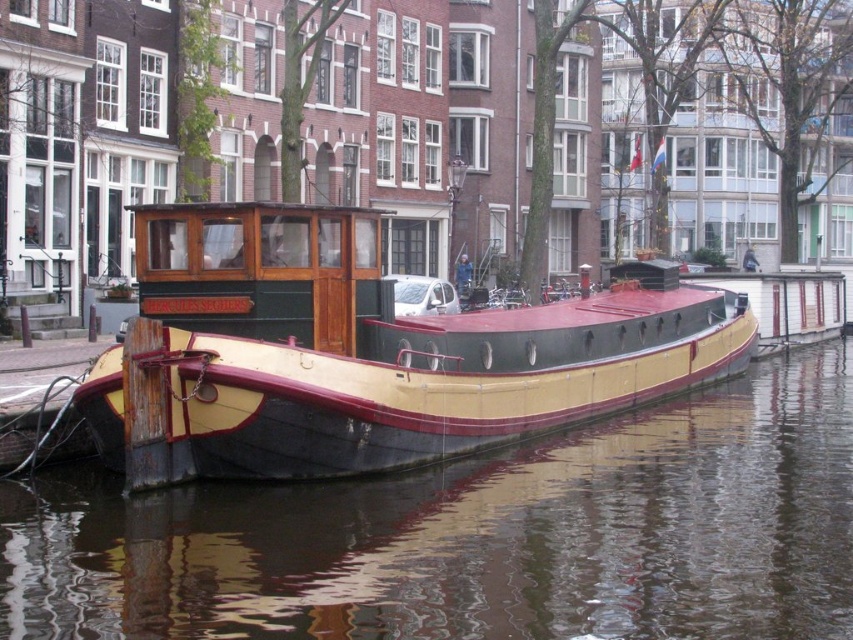
Which is in front, point (599, 454) or point (341, 282)?

Point (341, 282) is more forward.

Between smooth water at center and wooden cabin cruiser at center, which one is positioned higher?

Positioned higher is wooden cabin cruiser at center.

What are the coordinates of `smooth water at center` in the screenshot? It's located at (479, 536).

The height and width of the screenshot is (640, 853). Identify the location of smooth water at center. (479, 536).